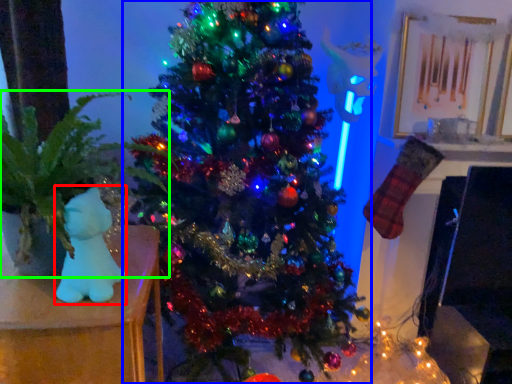
Question: Estimate the real-world distances between objects in this image. Which object is closer to toy (highlighted by a red box), christmas tree (highlighted by a blue box) or houseplant (highlighted by a green box)?

Choices:
 (A) christmas tree
 (B) houseplant

Answer: (B)